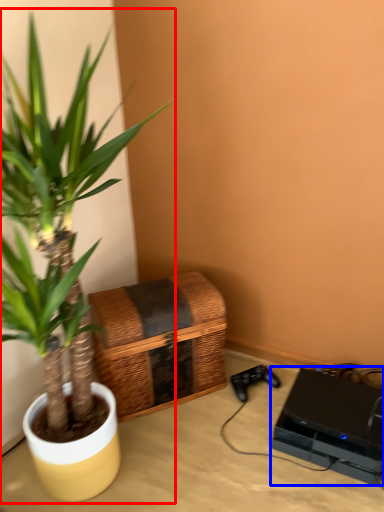
Question: Which object is closer to the camera taking this photo, houseplant (highlighted by a red box) or computer (highlighted by a blue box)?

Choices:
 (A) houseplant
 (B) computer

Answer: (A)